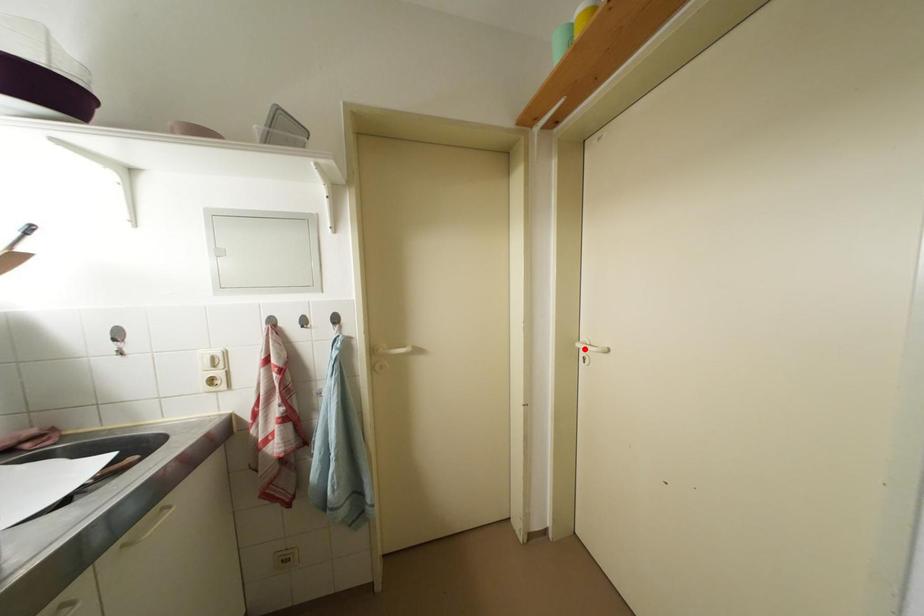
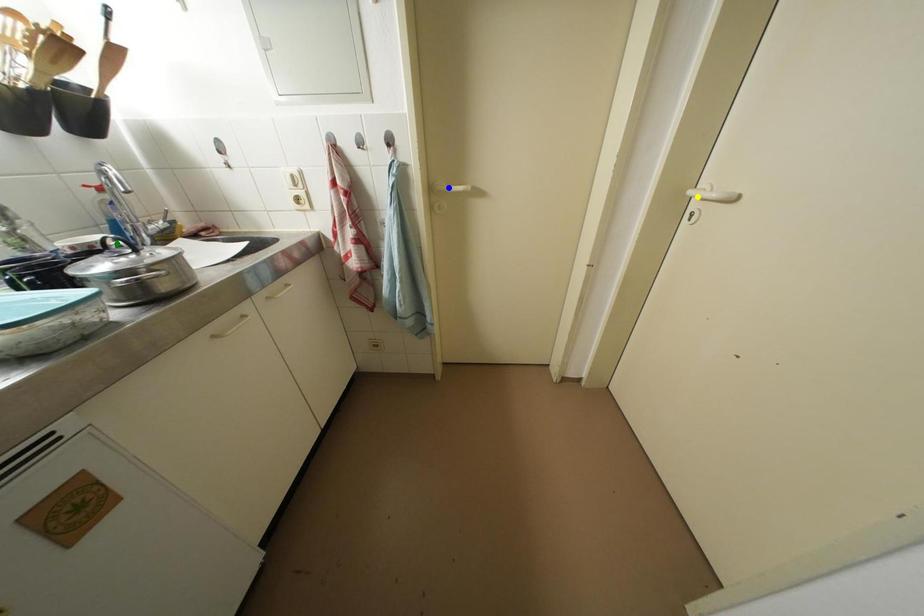
Question: I am providing you with two images of the same scene from different viewpoints. A red point is marked on the first image. You are given multiple points on the second image. In image 2, which mark is for the same physical point as the one in image 1?

Choices:
 (A) blue point
 (B) yellow point
 (C) green point

Answer: (B)